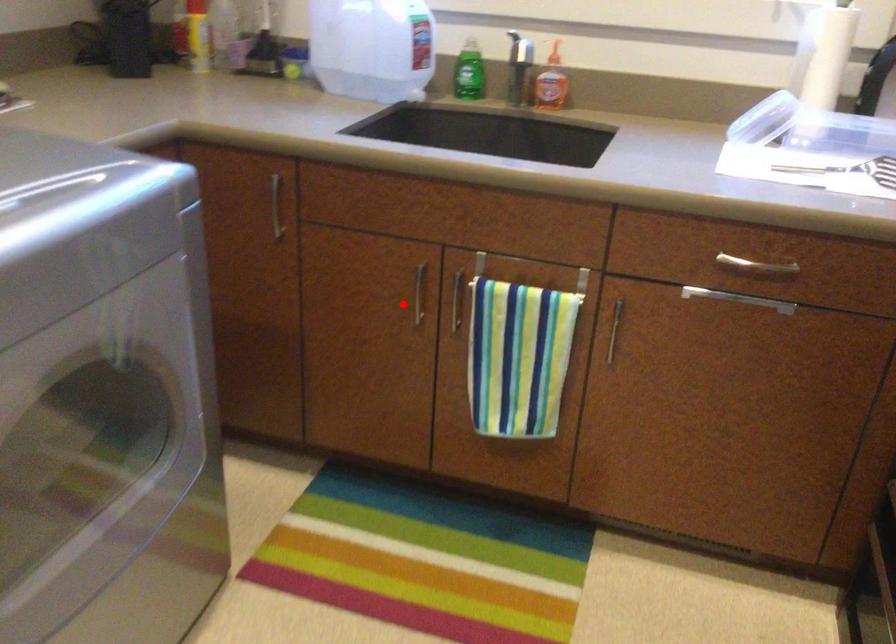
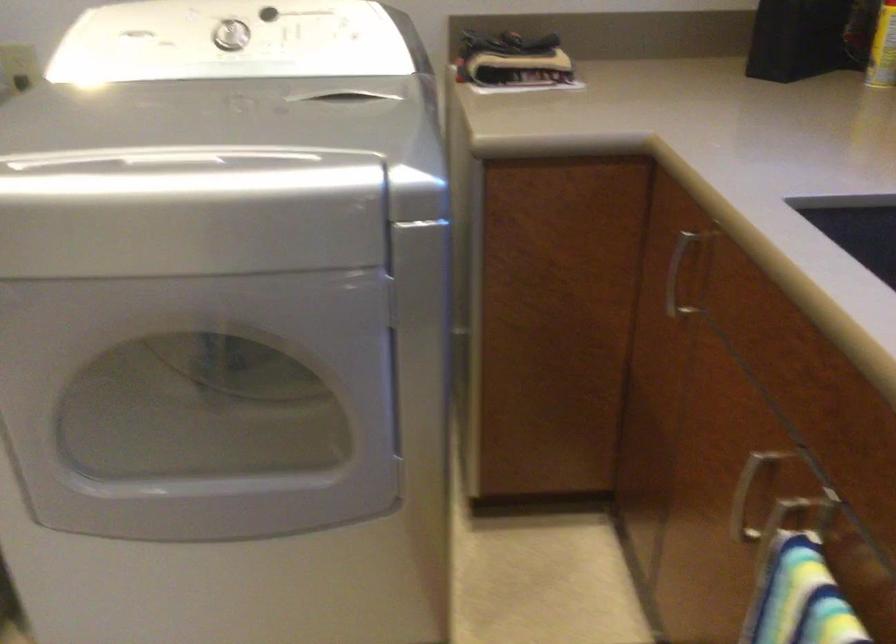
Where in the second image is the point corresponding to the highlighted location from the first image?

(745, 497)